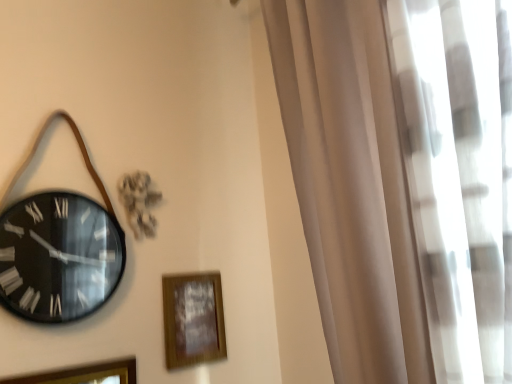
Question: Can you confirm if wooden picture frame at lower left, which ranks as the second picture frame in right-to-left order, is taller than wooden picture frame at lower center, marked as the first picture frame in a back-to-front arrangement?

Choices:
 (A) no
 (B) yes

Answer: (B)

Question: Is wooden picture frame at lower left, the second picture frame positioned from the back, facing away from wooden picture frame at lower center, which is the 2th picture frame in front-to-back order?

Choices:
 (A) yes
 (B) no

Answer: (B)

Question: Is there a large distance between wooden picture frame at lower left, which ranks as the second picture frame in right-to-left order, and wooden picture frame at lower center, arranged as the first picture frame when viewed from the right?

Choices:
 (A) no
 (B) yes

Answer: (A)

Question: From the image's perspective, is wooden picture frame at lower left, which ranks as the second picture frame in right-to-left order, under wooden picture frame at lower center, arranged as the first picture frame when viewed from the right?

Choices:
 (A) yes
 (B) no

Answer: (A)

Question: From a real-world perspective, is wooden picture frame at lower left, which ranks as the second picture frame in right-to-left order, on wooden picture frame at lower center, which is the 2th picture frame in front-to-back order?

Choices:
 (A) yes
 (B) no

Answer: (B)

Question: Is wooden picture frame at lower left, which ranks as the second picture frame in right-to-left order, at the right side of wooden picture frame at lower center, which is the 2th picture frame in front-to-back order?

Choices:
 (A) no
 (B) yes

Answer: (A)

Question: Is wooden picture frame at lower left, the second picture frame positioned from the back, in contact with white sheer curtain at right?

Choices:
 (A) yes
 (B) no

Answer: (B)

Question: Is wooden picture frame at lower left, which ranks as the second picture frame in right-to-left order, not inside white sheer curtain at right?

Choices:
 (A) no
 (B) yes

Answer: (B)

Question: Does wooden picture frame at lower left, acting as the first picture frame starting from the front, have a smaller size compared to white sheer curtain at right?

Choices:
 (A) no
 (B) yes

Answer: (B)

Question: Is the depth of wooden picture frame at lower left, which ranks as the second picture frame in right-to-left order, less than that of white sheer curtain at right?

Choices:
 (A) yes
 (B) no

Answer: (B)

Question: Is wooden picture frame at lower left, which ranks as the second picture frame in right-to-left order, facing towards white sheer curtain at right?

Choices:
 (A) yes
 (B) no

Answer: (B)

Question: Considering the relative sizes of wooden picture frame at lower left, which ranks as the second picture frame in right-to-left order, and white sheer curtain at right in the image provided, is wooden picture frame at lower left, which ranks as the second picture frame in right-to-left order, shorter than white sheer curtain at right?

Choices:
 (A) no
 (B) yes

Answer: (B)

Question: From the image's perspective, is wooden picture frame at lower center, marked as the first picture frame in a back-to-front arrangement, located beneath wooden picture frame at lower left, the second picture frame positioned from the back?

Choices:
 (A) yes
 (B) no

Answer: (B)